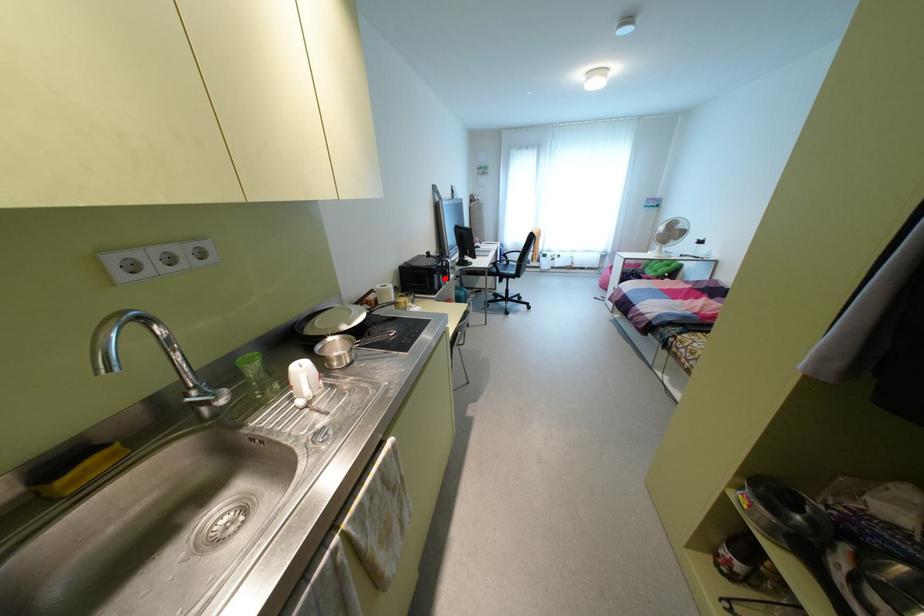
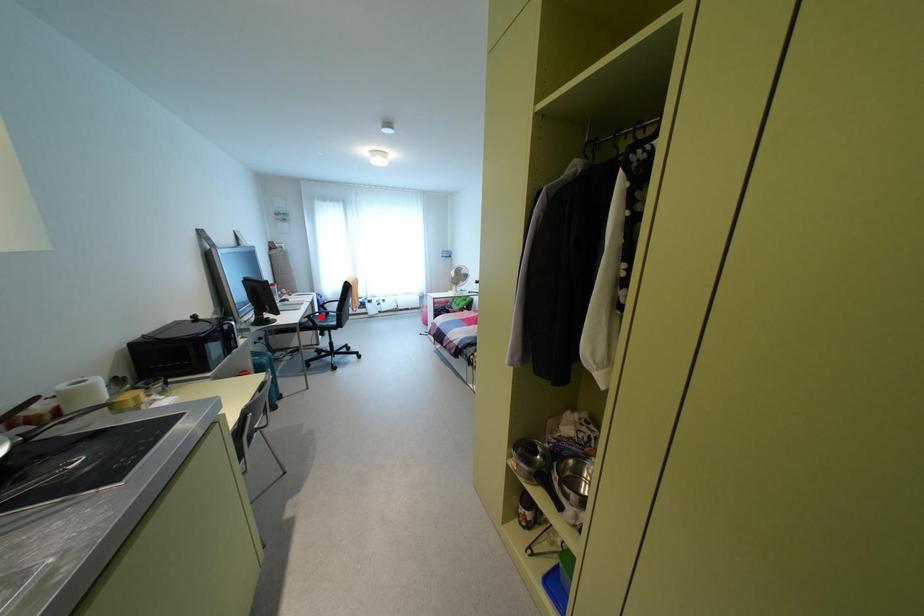
I am providing you with two images of the same scene from different viewpoints. A red point is marked on the first image and another point is marked on the second image. Are the points marked in image1 and image2 representing the same 3D position?

No